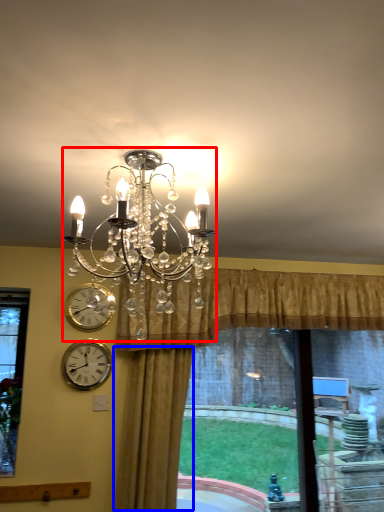
Question: Among these objects, which one is nearest to the camera, lamp (highlighted by a red box) or curtain (highlighted by a blue box)?

Choices:
 (A) lamp
 (B) curtain

Answer: (A)